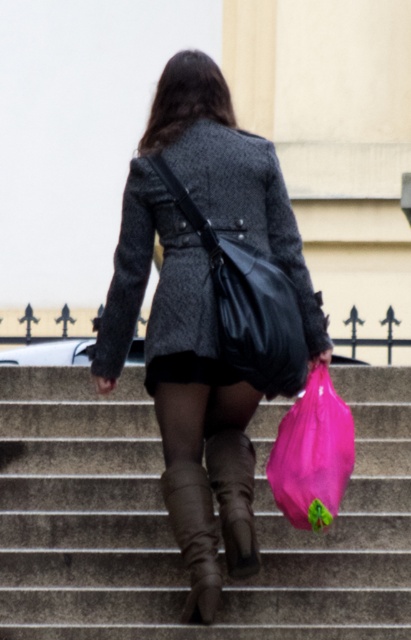
Question: Which point is farther to the camera?

Choices:
 (A) (314, 416)
 (B) (170, 129)

Answer: (B)

Question: Which point is closer to the camera?

Choices:
 (A) pink plastic bag at lower center
 (B) leather at center
 (C) brown suede boot at center
 (D) concrete stairs at center

Answer: (B)

Question: Can you confirm if black leather bag at center is wider than leather at center?

Choices:
 (A) no
 (B) yes

Answer: (B)

Question: Is black leather bag at center closer to the viewer compared to leather at center?

Choices:
 (A) yes
 (B) no

Answer: (B)

Question: Based on their relative distances, which object is nearer to the pink plastic bag at lower center?

Choices:
 (A) matte black coat at center
 (B) concrete stairs at center
 (C) leather at center

Answer: (A)

Question: Considering the relative positions of pink plastic bag at lower center and leather at center in the image provided, where is pink plastic bag at lower center located with respect to leather at center?

Choices:
 (A) right
 (B) left

Answer: (A)